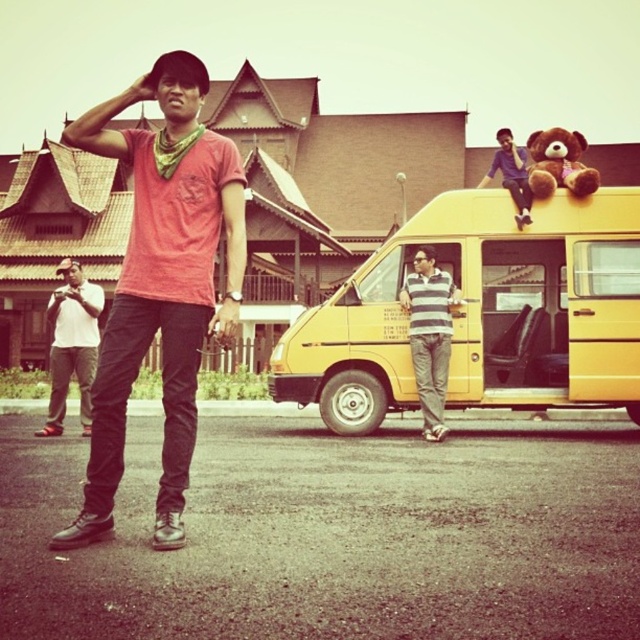
Question: Among these objects, which one is farthest from the camera?

Choices:
 (A) yellow matte van at center
 (B) brown plush bear at upper right
 (C) matte red t-shirt at center
 (D) striped fabric shirt at center

Answer: (A)

Question: Observing the image, what is the correct spatial positioning of white matte shirt at left in reference to blue striped shirt at upper right?

Choices:
 (A) left
 (B) right

Answer: (A)

Question: Which point is closer to the camera taking this photo?

Choices:
 (A) (541, 220)
 (B) (412, 326)

Answer: (B)

Question: Is matte red t-shirt at center positioned at the back of striped fabric shirt at center?

Choices:
 (A) no
 (B) yes

Answer: (A)

Question: Estimate the real-world distances between objects in this image. Which object is closer to the matte red t-shirt at center?

Choices:
 (A) striped fabric shirt at center
 (B) blue striped shirt at upper right

Answer: (A)

Question: Considering the relative positions of striped fabric shirt at center and white matte shirt at left in the image provided, where is striped fabric shirt at center located with respect to white matte shirt at left?

Choices:
 (A) left
 (B) right

Answer: (B)